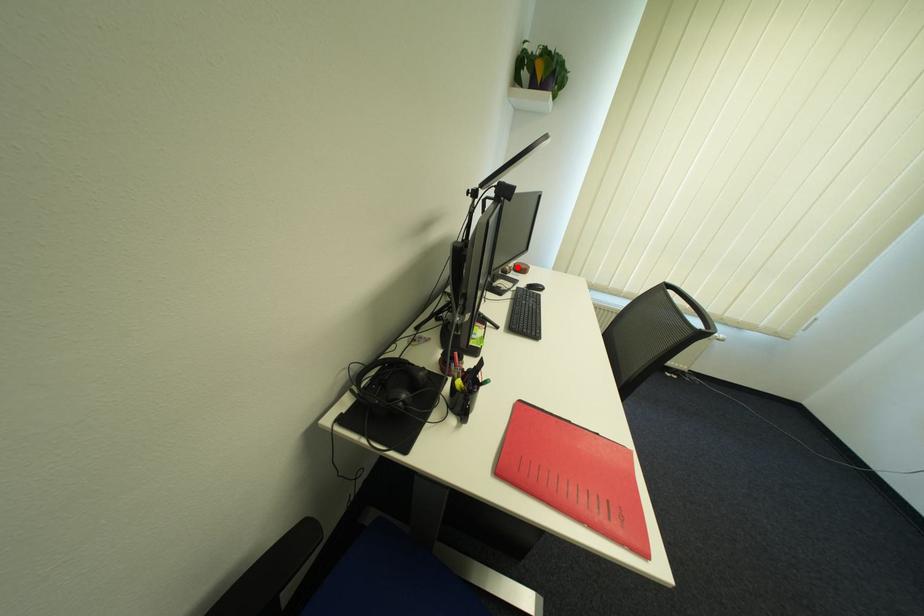
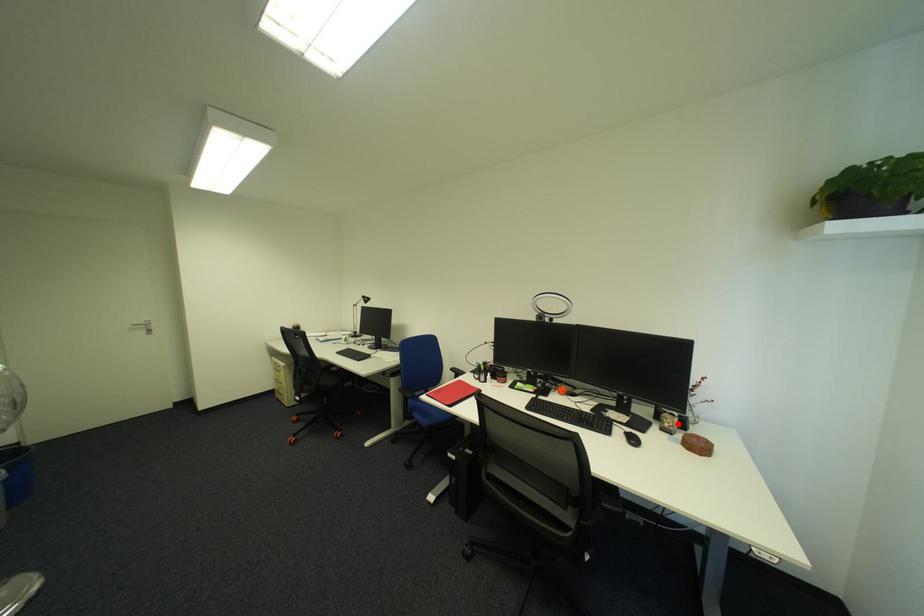
I am providing you with two images of the same scene from different viewpoints. A red point is marked on the first image and another point is marked on the second image. Are the points marked in image1 and image2 representing the same 3D position?

Yes